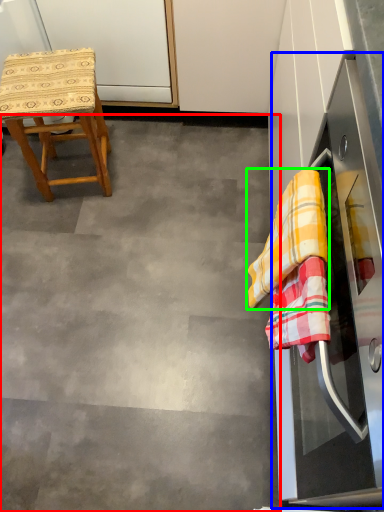
Question: Considering the real-world distances, which object is closest to concrete (highlighted by a red box)? oven (highlighted by a blue box) or clothe (highlighted by a green box).

Choices:
 (A) oven
 (B) clothe

Answer: (A)